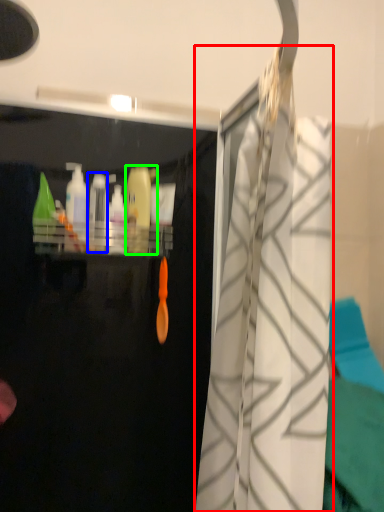
Question: Which object is positioned closest to curtain (highlighted by a red box)? Select from bottle (highlighted by a blue box) and cleaning product (highlighted by a green box).

Choices:
 (A) bottle
 (B) cleaning product

Answer: (B)